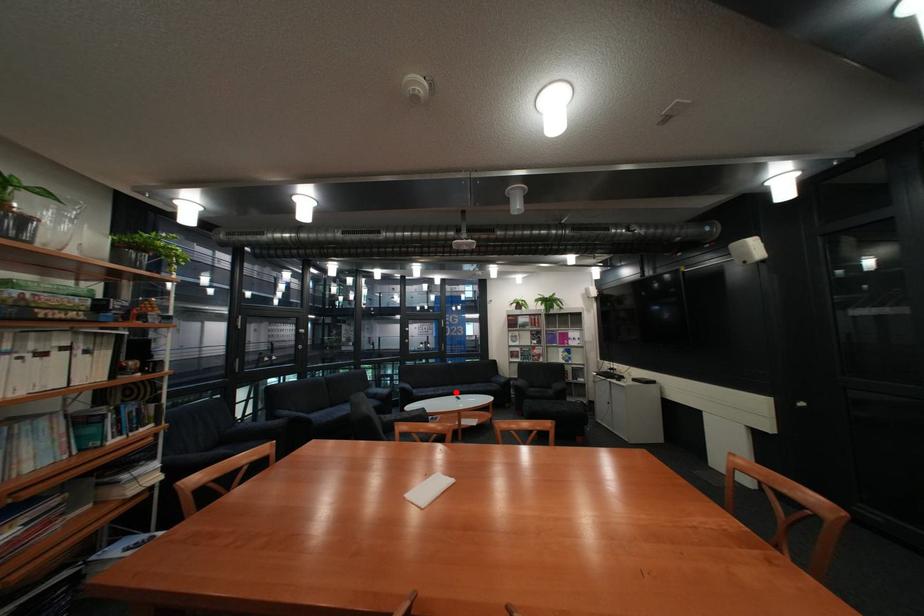
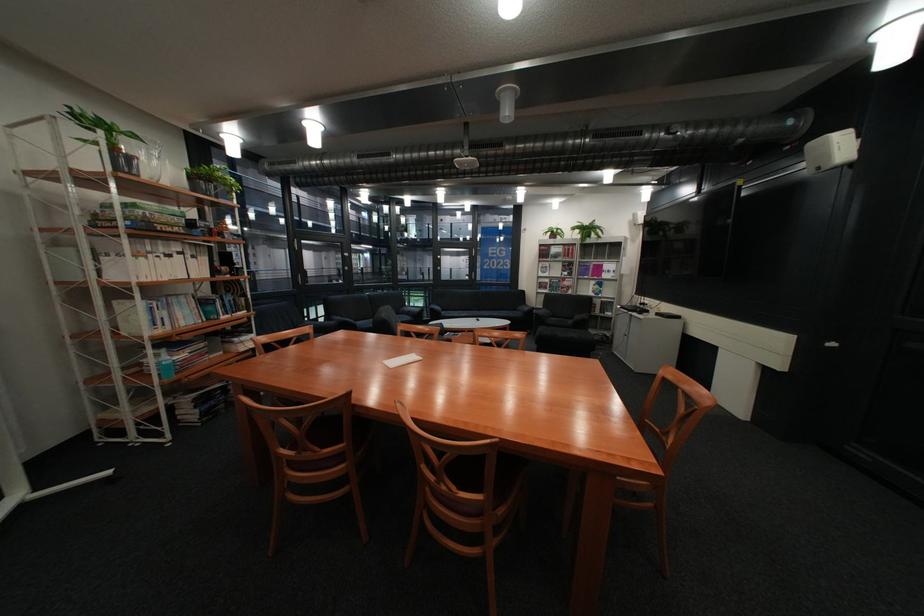
In the second image, find the point that corresponds to the highlighted location in the first image.

(481, 315)